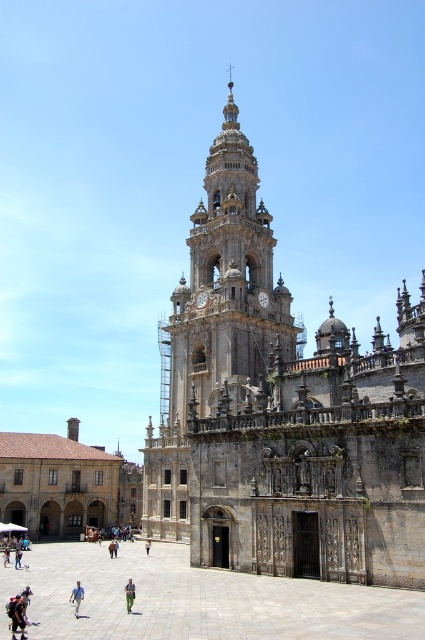
Does stone paved square at center have a larger size compared to golden stone tower at center?

Incorrect, stone paved square at center is not larger than golden stone tower at center.

Between stone paved square at center and golden stone tower at center, which one is positioned higher?

golden stone tower at center is above.

In order to click on stone paved square at center in this screenshot , I will do `click(195, 600)`.

Is stone paved square at center taller than light brown leather jacket at center?

Yes, stone paved square at center is taller than light brown leather jacket at center.

Can you confirm if stone paved square at center is positioned below light brown leather jacket at center?

Incorrect, stone paved square at center is not positioned below light brown leather jacket at center.

Identify the location of stone paved square at center. The height and width of the screenshot is (640, 425). (195, 600).

Does green fabric pants at lower center lie behind light brown leather jacket at center?

No, green fabric pants at lower center is in front of light brown leather jacket at center.

Between green fabric pants at lower center and light brown leather jacket at center, which one is positioned higher?

green fabric pants at lower center is above.

This screenshot has width=425, height=640. Describe the element at coordinates (130, 595) in the screenshot. I see `green fabric pants at lower center` at that location.

I want to click on green fabric pants at lower center, so click(130, 595).